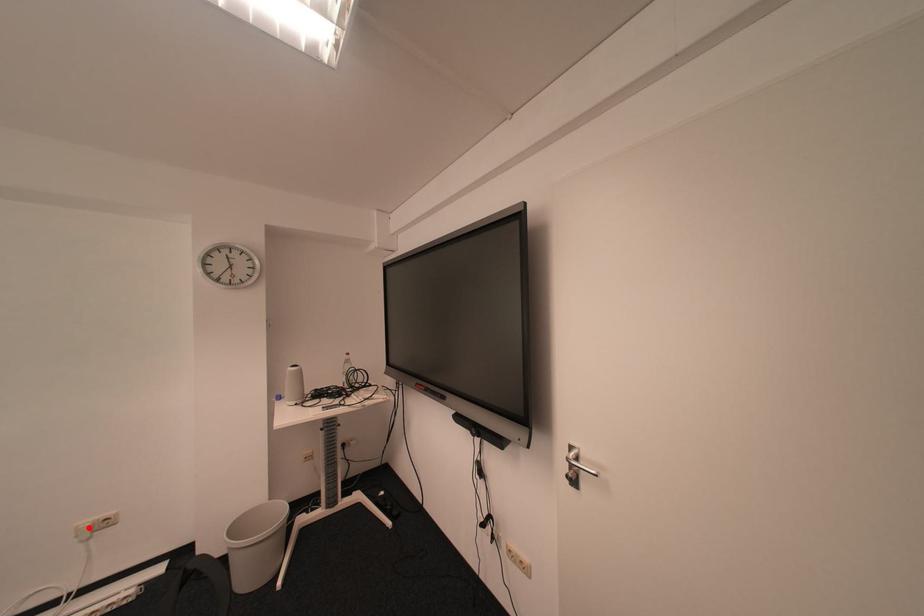
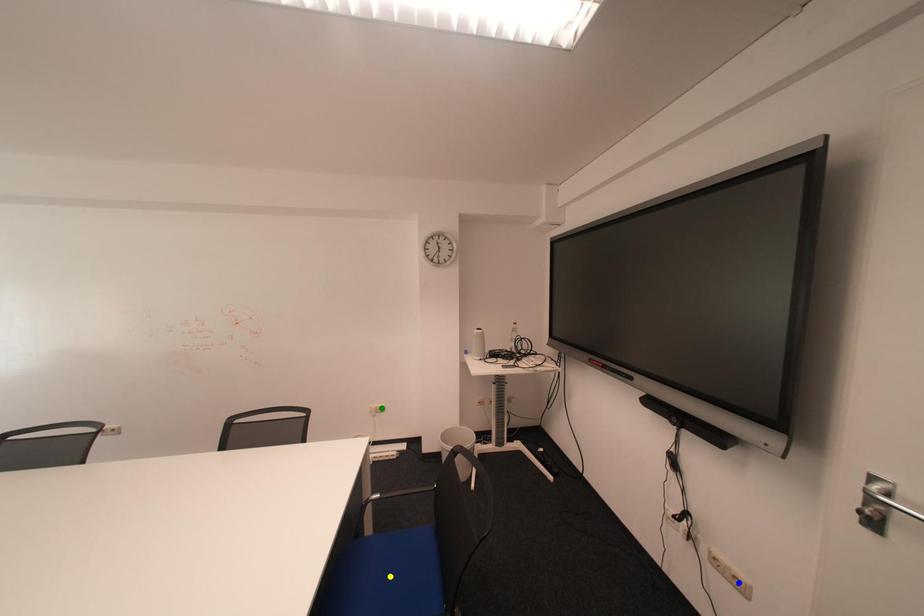
Question: I am providing you with two images of the same scene from different viewpoints. A red point is marked on the first image. You are given multiple points on the second image. In image 2, which mark is for the same physical point as the one in image 1?

Choices:
 (A) blue point
 (B) yellow point
 (C) green point

Answer: (C)